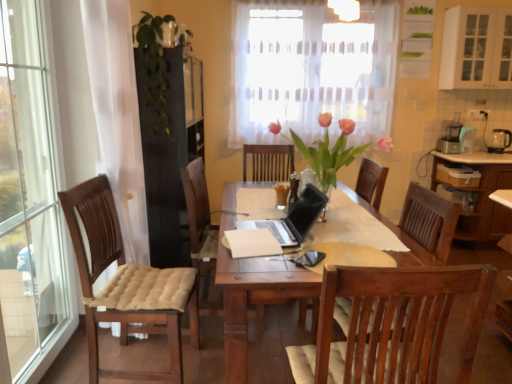
Question: Is the depth of green leafy plant at upper left, the 2th floral arrangement in the front-to-back sequence, greater than that of black glass kettle at right?

Choices:
 (A) yes
 (B) no

Answer: (B)

Question: From a real-world perspective, is green leafy plant at upper left, which ranks as the 1th floral arrangement in back-to-front order, on top of black glass kettle at right?

Choices:
 (A) yes
 (B) no

Answer: (A)

Question: Could you tell me if green leafy plant at upper left, which ranks as the 1th floral arrangement in back-to-front order, is turned towards black glass kettle at right?

Choices:
 (A) yes
 (B) no

Answer: (B)

Question: Can you confirm if green leafy plant at upper left, which appears as the first floral arrangement when viewed from the top, is shorter than black glass kettle at right?

Choices:
 (A) yes
 (B) no

Answer: (B)

Question: Does green leafy plant at upper left, arranged as the 1th floral arrangement when viewed from the left, appear on the left side of black glass kettle at right?

Choices:
 (A) no
 (B) yes

Answer: (B)

Question: From the image's perspective, would you say green leafy plant at upper left, arranged as the 1th floral arrangement when viewed from the left, is positioned over black glass kettle at right?

Choices:
 (A) no
 (B) yes

Answer: (B)

Question: Considering the relative positions of pink glass vase at center, the 1th floral arrangement from the right, and black glass kettle at right in the image provided, is pink glass vase at center, the 1th floral arrangement from the right, to the left of black glass kettle at right from the viewer's perspective?

Choices:
 (A) yes
 (B) no

Answer: (A)

Question: Does pink glass vase at center, which appears as the second floral arrangement when viewed from the top, have a smaller size compared to black glass kettle at right?

Choices:
 (A) no
 (B) yes

Answer: (A)

Question: Considering the relative sizes of pink glass vase at center, which appears as the second floral arrangement when viewed from the top, and black glass kettle at right in the image provided, is pink glass vase at center, which appears as the second floral arrangement when viewed from the top, taller than black glass kettle at right?

Choices:
 (A) no
 (B) yes

Answer: (B)

Question: Is pink glass vase at center, which appears as the second floral arrangement when viewed from the top, further to the viewer compared to black glass kettle at right?

Choices:
 (A) no
 (B) yes

Answer: (A)

Question: Is pink glass vase at center, which is the 2th floral arrangement from left to right, not within black glass kettle at right?

Choices:
 (A) no
 (B) yes

Answer: (B)

Question: Is pink glass vase at center, the 2th floral arrangement in the back-to-front sequence, thinner than black glass kettle at right?

Choices:
 (A) yes
 (B) no

Answer: (B)

Question: From the image's perspective, would you say pink glass vase at center, positioned as the 1th floral arrangement in front-to-back order, is positioned over wooden cabinet at right, positioned as the second cabinetry in top-to-bottom order?

Choices:
 (A) yes
 (B) no

Answer: (A)